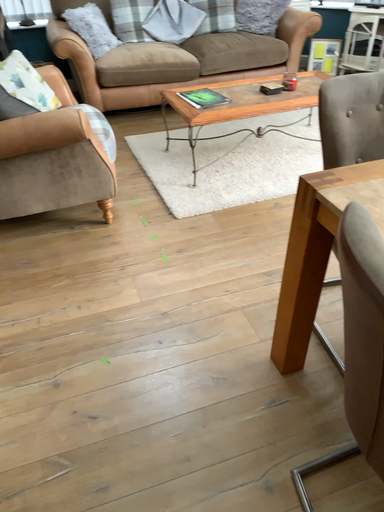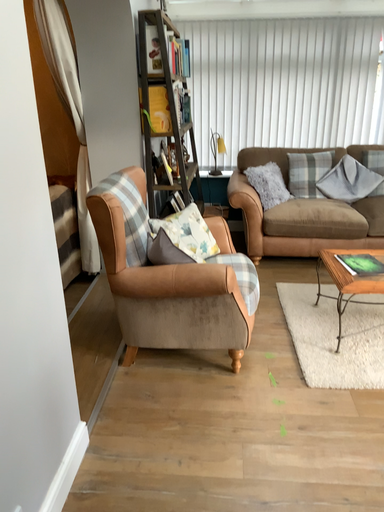
Question: How did the camera likely rotate when shooting the video?

Choices:
 (A) rotated right
 (B) rotated left

Answer: (B)